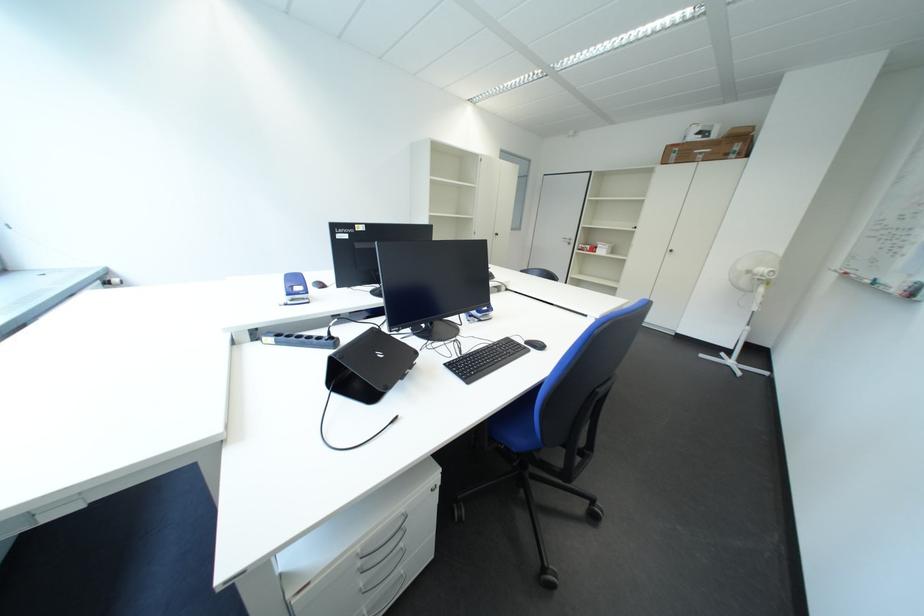
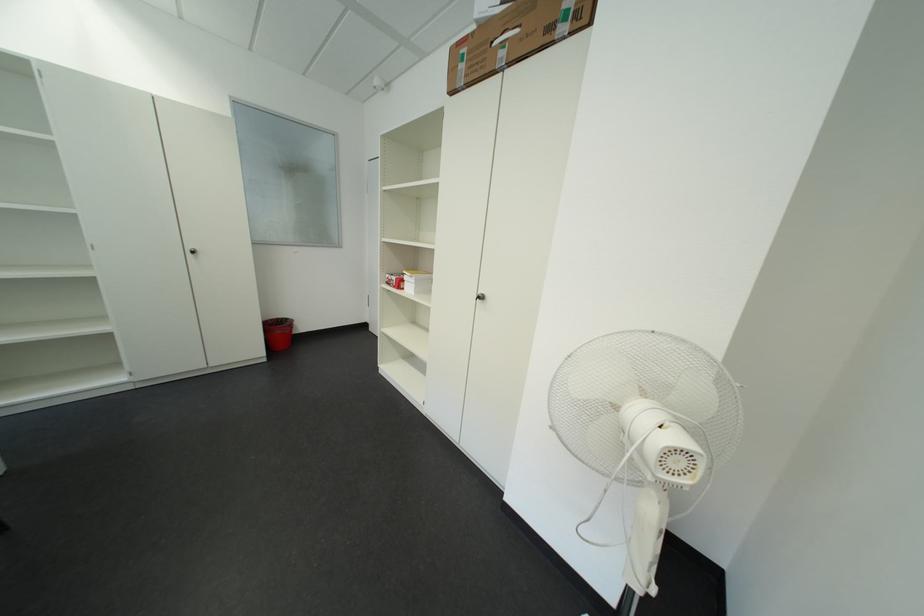
The images are taken continuously from a first-person perspective. In which direction are you moving?

The cameraman walked toward right, forward.